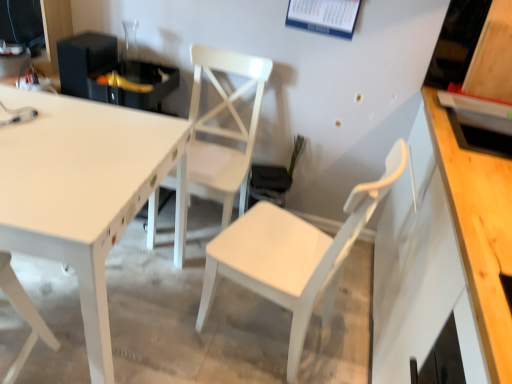
Question: Which direction should I rotate to look at white matte chair at center, which is the 2th chair from right to left, — up or down?

Choices:
 (A) down
 (B) up

Answer: (B)

Question: Is white matte chair at center, which is the 2th chair from right to left, outside of white glossy table at upper left?

Choices:
 (A) no
 (B) yes

Answer: (B)

Question: Is white matte chair at center, which is the 2th chair from right to left, further to the viewer compared to white glossy table at upper left?

Choices:
 (A) no
 (B) yes

Answer: (B)

Question: Is white matte chair at center, the second chair from the left, to the left of white glossy table at upper left from the viewer's perspective?

Choices:
 (A) yes
 (B) no

Answer: (B)

Question: Would you say white glossy table at upper left is part of white matte chair at center, which is the 2th chair from right to left,'s contents?

Choices:
 (A) no
 (B) yes

Answer: (A)

Question: Does white matte chair at center, which is the 2th chair from right to left, have a smaller size compared to white glossy table at upper left?

Choices:
 (A) no
 (B) yes

Answer: (B)

Question: Are white matte chair at center, the second chair from the left, and white glossy table at upper left far apart?

Choices:
 (A) yes
 (B) no

Answer: (B)

Question: Is white matte chair at lower left, which appears as the 3th chair when viewed from the right, positioned beyond the bounds of white glossy table at upper left?

Choices:
 (A) no
 (B) yes

Answer: (A)

Question: Does white matte chair at lower left, which appears as the 3th chair when viewed from the right, have a greater height compared to white glossy table at upper left?

Choices:
 (A) yes
 (B) no

Answer: (A)

Question: Is the depth of white matte chair at lower left, which appears as the 1th chair when viewed from the left, greater than that of white glossy table at upper left?

Choices:
 (A) no
 (B) yes

Answer: (A)

Question: Is white matte chair at lower left, which appears as the 1th chair when viewed from the left, far away from white glossy table at upper left?

Choices:
 (A) no
 (B) yes

Answer: (A)

Question: From the image's perspective, is white matte chair at lower left, which appears as the 3th chair when viewed from the right, below white glossy table at upper left?

Choices:
 (A) yes
 (B) no

Answer: (A)

Question: Is white matte chair at lower left, which appears as the 1th chair when viewed from the left, shorter than white glossy table at upper left?

Choices:
 (A) no
 (B) yes

Answer: (A)

Question: From the image's perspective, is white matte chair at center, which ranks as the first chair in right-to-left order, on white matte chair at lower left, which appears as the 1th chair when viewed from the left?

Choices:
 (A) no
 (B) yes

Answer: (B)